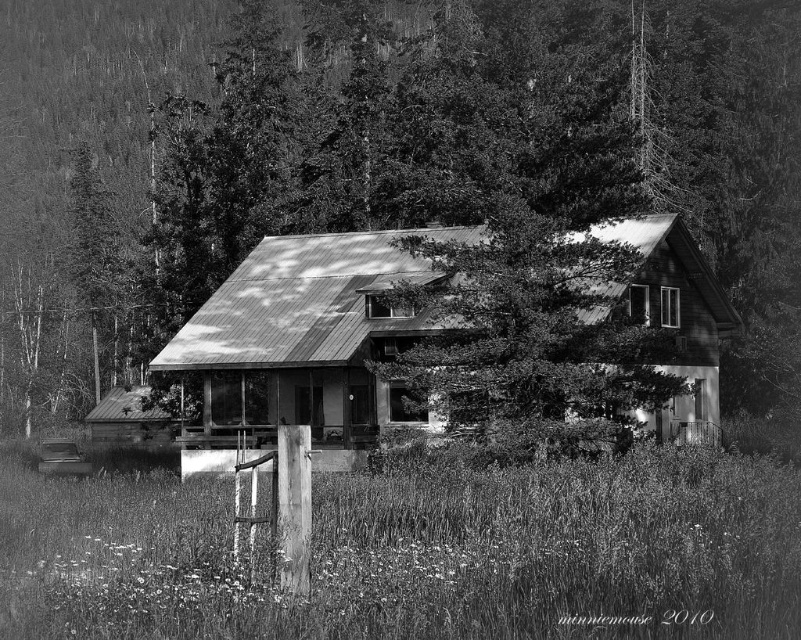
Is smooth bark tree at center closer to camera compared to rusty metal cabin at center?

No, it is not.

What do you see at coordinates (81, 125) in the screenshot? I see `smooth bark tree at center` at bounding box center [81, 125].

Who is more distant from viewer, (51, 81) or (252, 438)?

The point (51, 81) is more distant.

This screenshot has width=801, height=640. In order to click on smooth bark tree at center in this screenshot , I will do `click(81, 125)`.